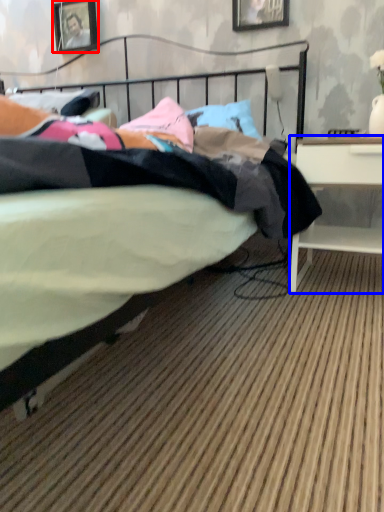
Question: Which point is closer to the camera, picture frame (highlighted by a red box) or desk (highlighted by a blue box)?

Choices:
 (A) picture frame
 (B) desk

Answer: (B)